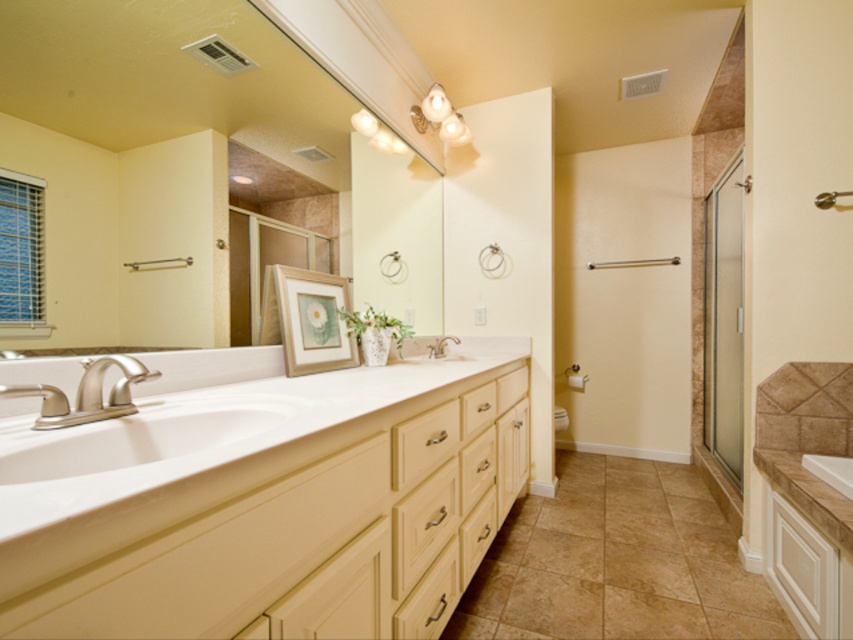
Is white laminate countertop at center to the left of white glossy sink at center from the viewer's perspective?

Correct, you'll find white laminate countertop at center to the left of white glossy sink at center.

Between white laminate countertop at center and white glossy sink at center, which one is positioned lower?

white laminate countertop at center

The width and height of the screenshot is (853, 640). In order to click on white laminate countertop at center in this screenshot , I will do `click(265, 502)`.

Find the location of a particular element. white laminate countertop at center is located at coordinates (265, 502).

Is white laminate countertop at center below matte white mirror at upper center?

Yes, white laminate countertop at center is below matte white mirror at upper center.

Is white laminate countertop at center smaller than matte white mirror at upper center?

Actually, white laminate countertop at center might be larger than matte white mirror at upper center.

Locate an element on the screen. white laminate countertop at center is located at coordinates coord(265,502).

This screenshot has height=640, width=853. Identify the location of matte white mirror at upper center. (149, 150).

Which of these two, matte white mirror at upper center or white glossy sink at center, stands shorter?

With less height is white glossy sink at center.

Is point (132, 28) positioned behind point (434, 355)?

That is False.

Locate an element on the screen. The height and width of the screenshot is (640, 853). matte white mirror at upper center is located at coordinates (149, 150).